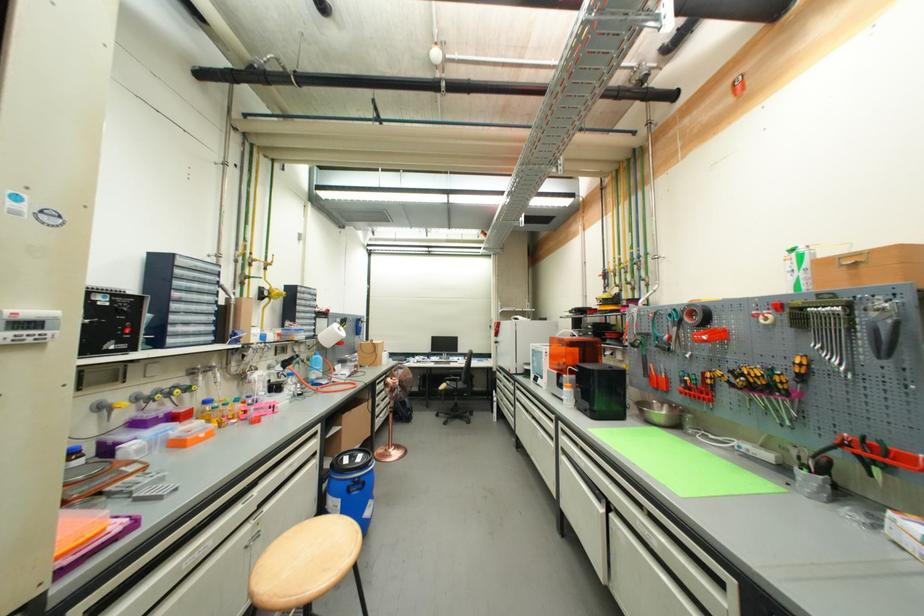
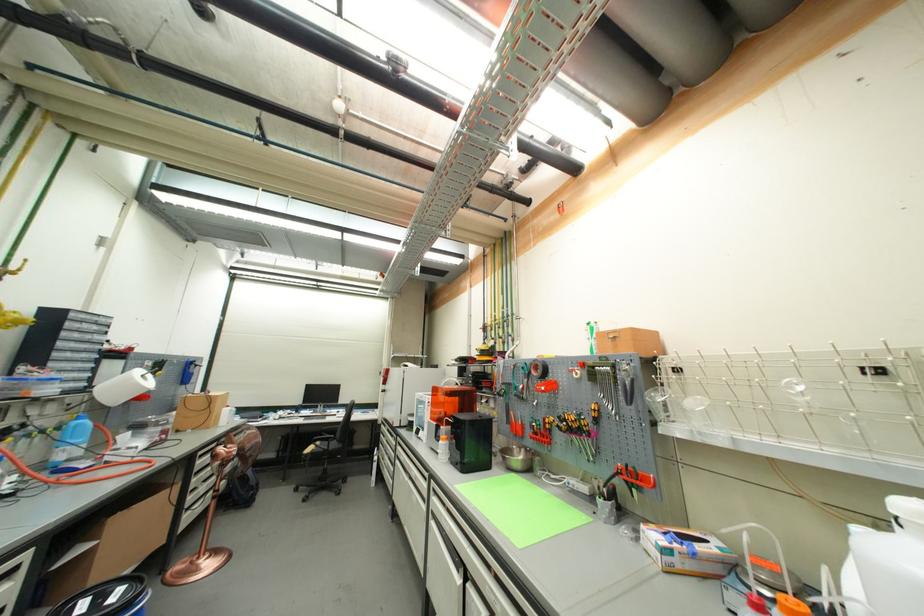
Locate, in the second image, the point that corresponds to the point at 500,392 in the first image.

(382, 450)